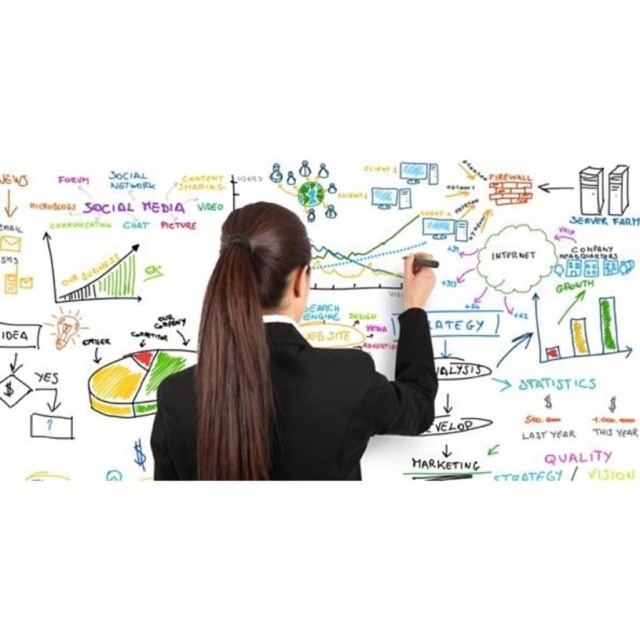
You are a robot with a 15 cm wide arm. You need to reach the whiteboard at center while avoiding the black suit at center. Is there enough space between them for your arm?

The distance between the whiteboard at center and the black suit at center is 21.53 centimeters. Since your arm is 15 cm wide, there is sufficient space for your arm to fit between them.

Looking at this image, you are an attendee at a marketing workshop and see the whiteboard at center and the brown silky hair at center. Which object is closer to you?

The whiteboard at center is closer to you because the brown silky hair at center is behind it.

You are a photographer standing 10 feet away from the whiteboard at center and brown silky hair at center. You want to take a photo that includes both objects in the frame. Given that your camera has a maximum focus range of 10 feet, will both objects be in focus?

The whiteboard at center is 12.51 inches from brown silky hair at center. Since both objects are within the same plane and the distance between them is minimal, they will both be in focus at 10 feet.